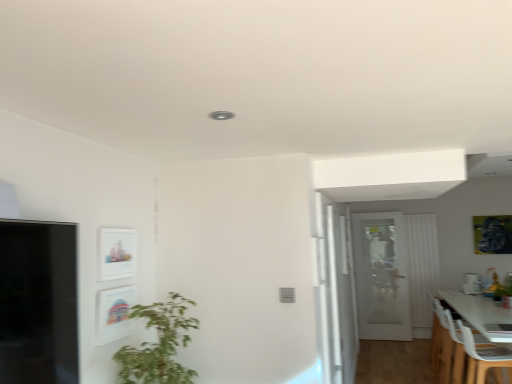
Question: From the image's perspective, would you say white fabric curtain at right is shown under green leafy plant at lower right?

Choices:
 (A) yes
 (B) no

Answer: (A)

Question: From the image's perspective, would you say white fabric curtain at right is positioned over green leafy plant at lower right?

Choices:
 (A) no
 (B) yes

Answer: (A)

Question: Is white fabric curtain at right bigger than green leafy plant at lower right?

Choices:
 (A) yes
 (B) no

Answer: (A)

Question: Considering the relative sizes of white fabric curtain at right and green leafy plant at lower right in the image provided, is white fabric curtain at right wider than green leafy plant at lower right?

Choices:
 (A) yes
 (B) no

Answer: (B)

Question: From a real-world perspective, is white fabric curtain at right on green leafy plant at lower right?

Choices:
 (A) yes
 (B) no

Answer: (A)

Question: Considering the positions of green leafy plant at lower left and matte white picture frame at upper left, positioned as the 1th picture frame in left-to-right order, in the image, is green leafy plant at lower left bigger or smaller than matte white picture frame at upper left, positioned as the 1th picture frame in left-to-right order,?

Choices:
 (A) big
 (B) small

Answer: (A)

Question: Is point (187, 377) closer or farther from the camera than point (113, 264)?

Choices:
 (A) farther
 (B) closer

Answer: (B)

Question: Choose the correct answer: Is green leafy plant at lower left inside matte white picture frame at upper left, positioned as the 1th picture frame in left-to-right order, or outside it?

Choices:
 (A) inside
 (B) outside

Answer: (B)

Question: Considering the relative positions of green leafy plant at lower left and matte white picture frame at upper left, marked as the third picture frame in a right-to-left arrangement, in the image provided, is green leafy plant at lower left to the left or to the right of matte white picture frame at upper left, marked as the third picture frame in a right-to-left arrangement,?

Choices:
 (A) left
 (B) right

Answer: (B)

Question: Is point [x=402, y=331] positioned closer to the camera than point [x=122, y=321]?

Choices:
 (A) farther
 (B) closer

Answer: (A)

Question: Visually, is white glass door at center positioned to the left or to the right of matte white picture frame at lower left, which is counted as the third picture frame, starting from the back?

Choices:
 (A) left
 (B) right

Answer: (B)

Question: Considering the positions of white glass door at center and matte white picture frame at lower left, the 1th picture frame in the front-to-back sequence, in the image, is white glass door at center wider or thinner than matte white picture frame at lower left, the 1th picture frame in the front-to-back sequence,?

Choices:
 (A) thin
 (B) wide

Answer: (B)

Question: From the image's perspective, is white glass door at center positioned above or below matte white picture frame at lower left, which is counted as the third picture frame, starting from the back?

Choices:
 (A) below
 (B) above

Answer: (A)

Question: Is white plastic chair at lower right, marked as the second chair in a back-to-front arrangement, bigger or smaller than green leafy plant at lower left?

Choices:
 (A) small
 (B) big

Answer: (A)

Question: From a real-world perspective, relative to green leafy plant at lower left, is white plastic chair at lower right, marked as the second chair in a back-to-front arrangement, vertically above or below?

Choices:
 (A) below
 (B) above

Answer: (A)